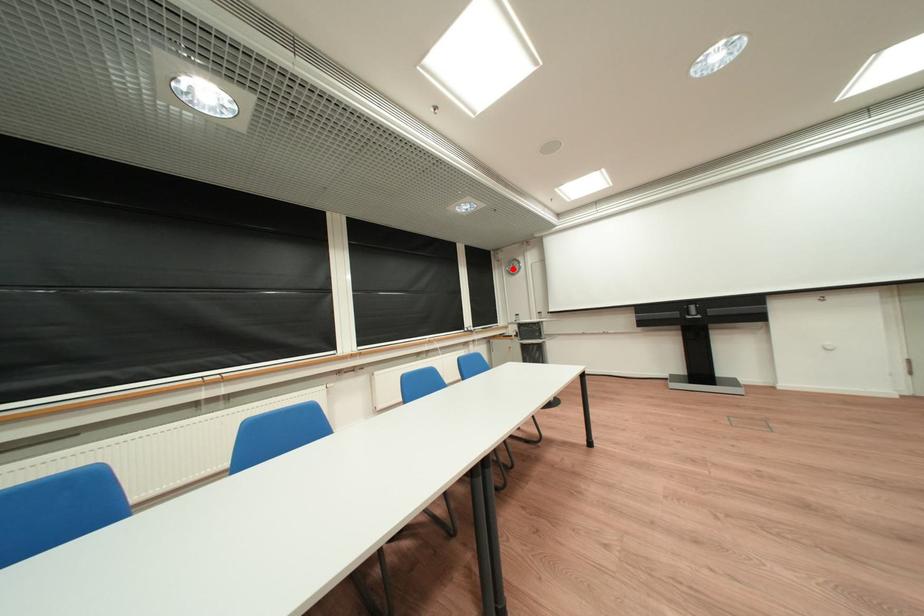
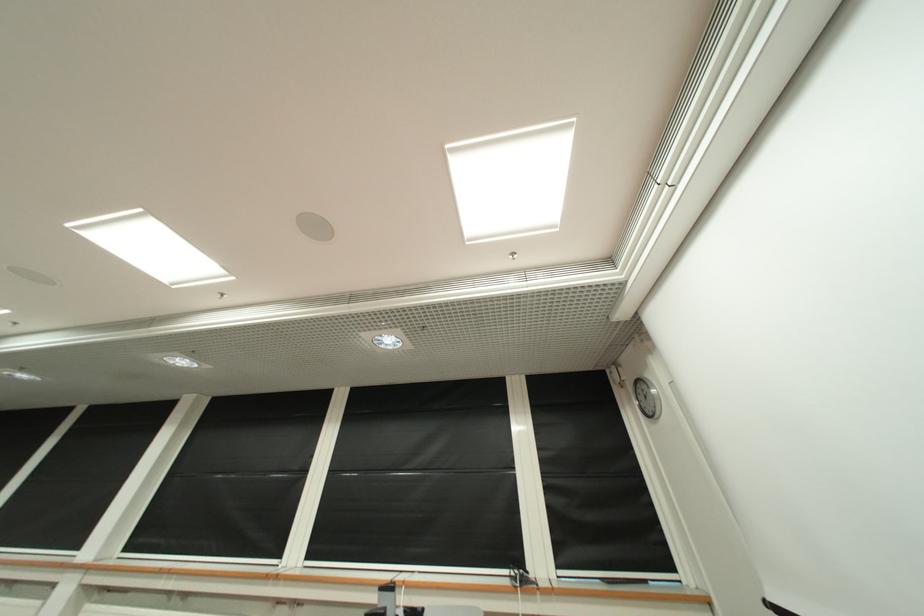
Where in the second image is the point corresponding to the highlighted location from the first image?

(642, 402)